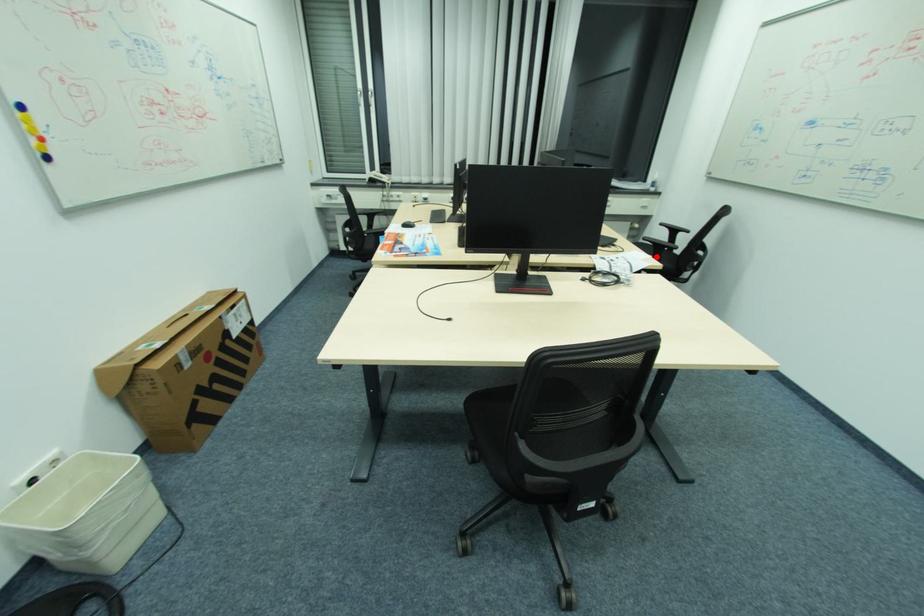
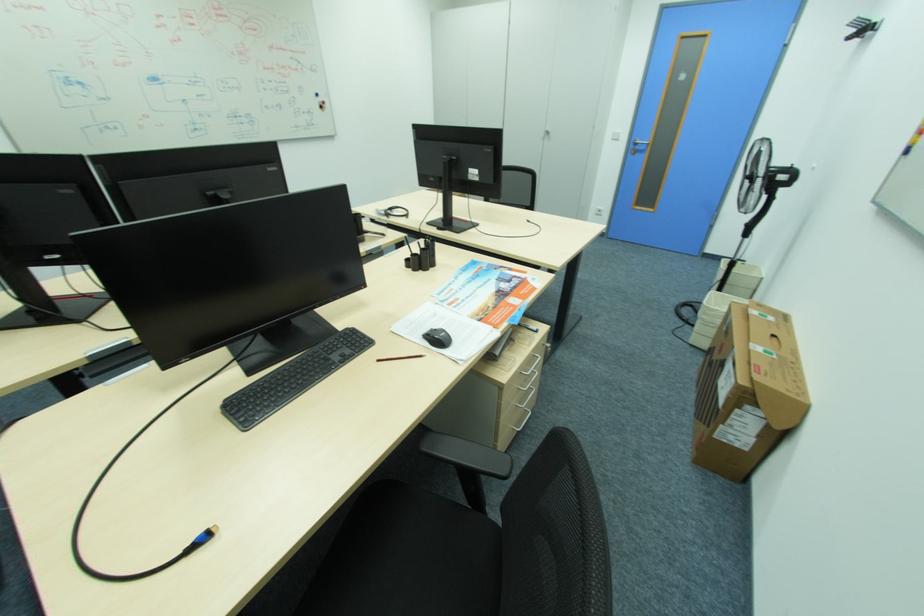
Question: I am providing you with two images of the same scene from different viewpoints. A red point is marked on the first image. At the location where the point appears in image 1, is it still visible in image 2?

Choices:
 (A) Yes
 (B) No

Answer: (B)